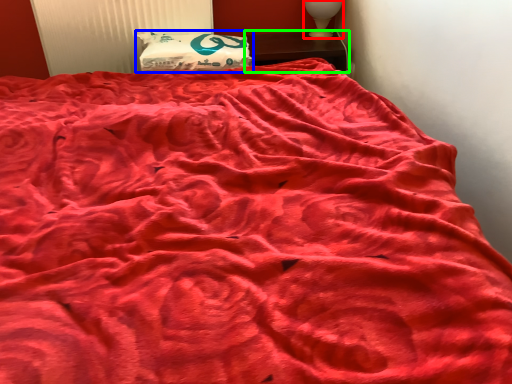
Question: Based on their relative distances, which object is nearer to table lamp (highlighted by a red box)? Choose from pillow (highlighted by a blue box) and furniture (highlighted by a green box).

Choices:
 (A) pillow
 (B) furniture

Answer: (B)